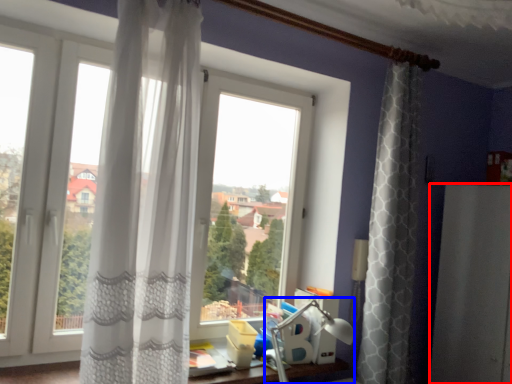
Question: Which object appears closest to the camera in this image, screen door (highlighted by a red box) or table lamp (highlighted by a blue box)?

Choices:
 (A) screen door
 (B) table lamp

Answer: (B)